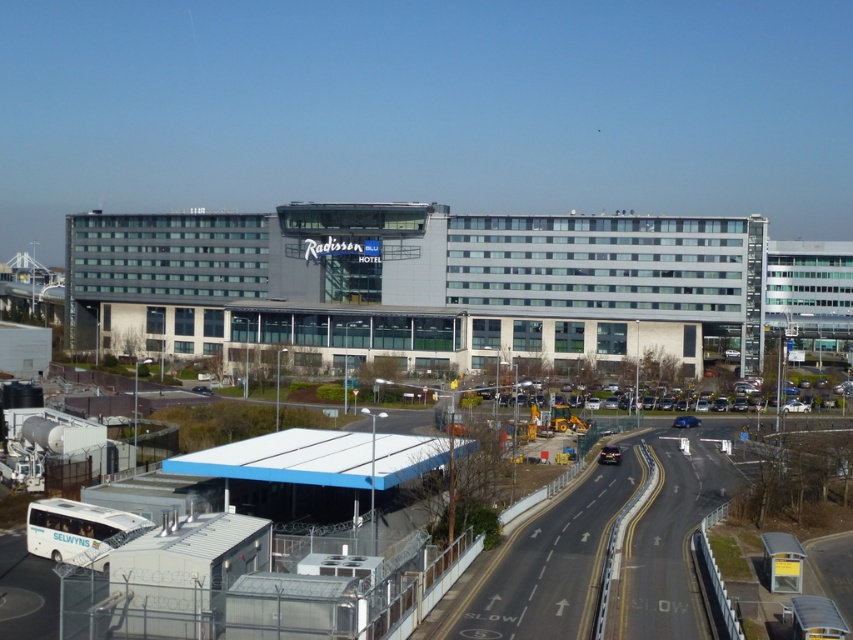
You are a tourist trying to locate the gray concrete radisson blu hotel at center from the white matte bus station at lower left. Based on the scene, which direction should you walk to reach the hotel?

The gray concrete radisson blu hotel at center is larger in size compared to the white matte bus station at lower left, so you should walk towards the larger structure in the center to reach the hotel.

From the picture: You are a delivery driver approaching the gray concrete radisson blu hotel at center and the white matte bus at lower left. Which object is positioned higher in the image?

The gray concrete radisson blu hotel at center is located above the white matte bus at lower left, so it is positioned higher in the image.

You are a delivery driver who needs to park your truck next to the gray concrete Radisson Blu Hotel at center and the white matte bus station at lower left. Which object should you park closer to if you want to ensure your truck fits between them without any overhang?

The gray concrete Radisson Blu Hotel at center might be wider than the white matte bus station at lower left, so you should park closer to the narrower white matte bus station at lower left to ensure the truck fits between them without overhang.